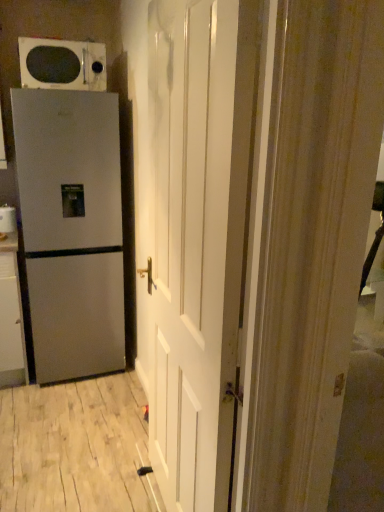
Question: Is the depth of white glossy door at center greater than that of white glossy microwave at upper left?

Choices:
 (A) yes
 (B) no

Answer: (B)

Question: Is white glossy door at center directly adjacent to white glossy microwave at upper left?

Choices:
 (A) yes
 (B) no

Answer: (B)

Question: Is white glossy microwave at upper left at the back of white glossy door at center?

Choices:
 (A) yes
 (B) no

Answer: (B)

Question: Is white glossy door at center closer to camera compared to white glossy microwave at upper left?

Choices:
 (A) no
 (B) yes

Answer: (B)

Question: Is white glossy door at center at the left side of white glossy microwave at upper left?

Choices:
 (A) no
 (B) yes

Answer: (A)

Question: Can white glossy microwave at upper left be found inside white glossy door at center?

Choices:
 (A) yes
 (B) no

Answer: (B)

Question: Does satin silver refrigerator at left appear on the left side of white glossy microwave at upper left?

Choices:
 (A) yes
 (B) no

Answer: (A)

Question: Can you confirm if satin silver refrigerator at left is smaller than white glossy microwave at upper left?

Choices:
 (A) yes
 (B) no

Answer: (B)

Question: Could you tell me if satin silver refrigerator at left is turned towards white glossy microwave at upper left?

Choices:
 (A) no
 (B) yes

Answer: (A)

Question: Is satin silver refrigerator at left oriented away from white glossy microwave at upper left?

Choices:
 (A) no
 (B) yes

Answer: (A)

Question: From the image's perspective, does satin silver refrigerator at left appear higher than white glossy microwave at upper left?

Choices:
 (A) yes
 (B) no

Answer: (B)

Question: Considering the relative sizes of satin silver refrigerator at left and white glossy microwave at upper left in the image provided, is satin silver refrigerator at left thinner than white glossy microwave at upper left?

Choices:
 (A) yes
 (B) no

Answer: (B)

Question: Can you confirm if white glossy cabinet at left is taller than white glossy door at center?

Choices:
 (A) no
 (B) yes

Answer: (A)